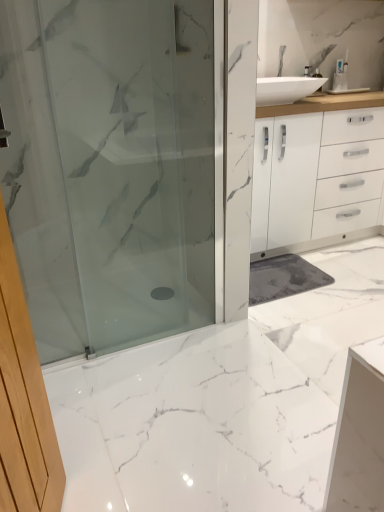
Locate an element on the screen. The image size is (384, 512). free space in front of satin glass shower door at center is located at coordinates [x=155, y=404].